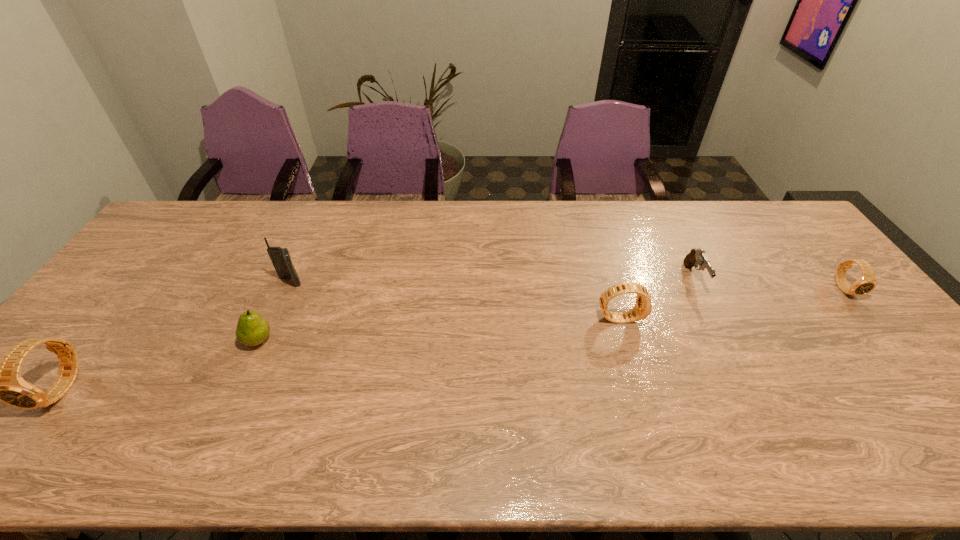
Image resolution: width=960 pixels, height=540 pixels. Identify the location of free spot between the second watch from right to left and the pear. (439, 329).

The image size is (960, 540). I want to click on empty location between the shortest watch and the leftmost watch, so click(x=454, y=339).

Where is `empty space that is in between the pear and the second watch from left to right`? empty space that is in between the pear and the second watch from left to right is located at coordinates (439, 329).

Find the location of a particular element. Image resolution: width=960 pixels, height=540 pixels. object that ranks as the fifth closest to the rightmost object is located at coordinates (1, 381).

This screenshot has height=540, width=960. What are the coordinates of `the fifth closest object to the second tallest watch` in the screenshot? It's located at (1, 381).

Where is `watch that is the third closest to the cellular telephone`? This screenshot has height=540, width=960. watch that is the third closest to the cellular telephone is located at coordinates (867, 282).

Where is `the second closest watch to the cellular telephone`? The width and height of the screenshot is (960, 540). the second closest watch to the cellular telephone is located at coordinates (643, 306).

I want to click on free point that satisfies the following two spatial constraints: 1. on the face of the second farthest watch; 2. on the face of the tallest watch, so click(640, 389).

Where is `vacant position in the image that satisfies the following two spatial constraints: 1. on the face of the second nearest watch; 2. on the face of the nearest object`? The image size is (960, 540). vacant position in the image that satisfies the following two spatial constraints: 1. on the face of the second nearest watch; 2. on the face of the nearest object is located at coordinates (640, 389).

The height and width of the screenshot is (540, 960). What are the coordinates of `free space that satisfies the following two spatial constraints: 1. on the face of the farthest watch; 2. on the face of the second watch from left to right` in the screenshot? It's located at (869, 318).